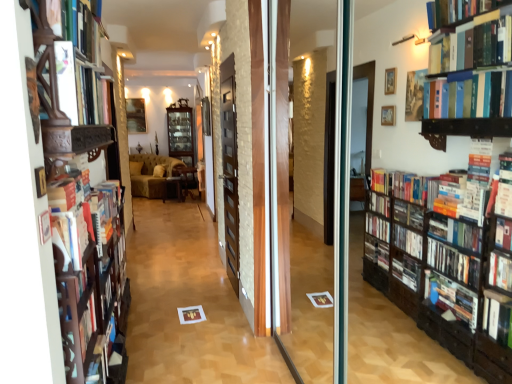
What do you see at coordinates (176, 186) in the screenshot? I see `wooden side table at center, the 2th furniture when ordered from left to right` at bounding box center [176, 186].

Measure the distance between point (136,154) and camera.

The depth of point (136,154) is 26.91 feet.

The width and height of the screenshot is (512, 384). I want to click on velvet brown sofa at center, the 3th furniture from the right, so click(x=152, y=175).

Measure the distance between matte white book at left, which is counted as the 2th book, starting from the top, and camera.

matte white book at left, which is counted as the 2th book, starting from the top, is 1.47 meters away from camera.

Describe the element at coordinates (81, 87) in the screenshot. This screenshot has width=512, height=384. I see `matte white book at left, which is counted as the 2th book, starting from the top` at that location.

The height and width of the screenshot is (384, 512). Identify the location of matte brown paper at center. (191, 314).

Consider the image. How many degrees apart are the facing directions of wooden table at center, the third furniture positioned from the left, and matte white book at upper left, which ranks as the 1th book in top-to-bottom order?

100 degrees separate the facing orientations of wooden table at center, the third furniture positioned from the left, and matte white book at upper left, which ranks as the 1th book in top-to-bottom order.

Who is more distant, wooden table at center, which appears as the 1th furniture when viewed from the right, or matte white book at upper left, which ranks as the 1th book in top-to-bottom order?

Positioned behind is wooden table at center, which appears as the 1th furniture when viewed from the right.

Considering the relative sizes of wooden table at center, which appears as the 1th furniture when viewed from the right, and matte white book at upper left, which ranks as the 2th book in bottom-to-top order, in the image provided, is wooden table at center, which appears as the 1th furniture when viewed from the right, taller than matte white book at upper left, which ranks as the 2th book in bottom-to-top order,?

Indeed, wooden table at center, which appears as the 1th furniture when viewed from the right, has a greater height compared to matte white book at upper left, which ranks as the 2th book in bottom-to-top order.

From a real-world perspective, between wooden table at center, the third furniture positioned from the left, and matte white book at upper left, which ranks as the 1th book in top-to-bottom order, who is vertically lower?

From a 3D spatial view, wooden table at center, the third furniture positioned from the left, is below.

Between wooden table at center, which appears as the 1th furniture when viewed from the right, and matte white book at left, which is counted as the 2th book, starting from the top, which one has smaller width?

With smaller width is matte white book at left, which is counted as the 2th book, starting from the top.

Could you tell me if wooden table at center, the third furniture positioned from the left, is turned towards matte white book at left, which is the first book from bottom to top?

Yes, wooden table at center, the third furniture positioned from the left, is aimed at matte white book at left, which is the first book from bottom to top.

Considering the positions of objects wooden table at center, which appears as the 1th furniture when viewed from the right, and matte white book at left, which is the first book from bottom to top, in the image provided, who is behind, wooden table at center, which appears as the 1th furniture when viewed from the right, or matte white book at left, which is the first book from bottom to top,?

wooden table at center, which appears as the 1th furniture when viewed from the right, is behind.

Is wooden table at center, which appears as the 1th furniture when viewed from the right, closer to the viewer compared to wooden side table at center, the 2th furniture when ordered from left to right?

That is True.

Is point (179, 173) more distant than point (163, 200)?

Yes, point (179, 173) is farther from viewer.

How different are the orientations of wooden table at center, which appears as the 1th furniture when viewed from the right, and wooden side table at center, the 2th furniture when ordered from left to right, in degrees?

2.85 degrees.

Would you consider wooden table at center, the third furniture positioned from the left, to be distant from wooden side table at center, the 2th furniture when ordered from left to right?

wooden table at center, the third furniture positioned from the left, is near wooden side table at center, the 2th furniture when ordered from left to right, not far away.

How many degrees apart are the facing directions of wooden side table at center, marked as the second furniture in a right-to-left arrangement, and velvet brown sofa at center, the 3th furniture from the right?

There is a 8.12-degree angle between the facing directions of wooden side table at center, marked as the second furniture in a right-to-left arrangement, and velvet brown sofa at center, the 3th furniture from the right.

Considering the sizes of objects wooden side table at center, marked as the second furniture in a right-to-left arrangement, and velvet brown sofa at center, the 3th furniture from the right, in the image provided, who is bigger, wooden side table at center, marked as the second furniture in a right-to-left arrangement, or velvet brown sofa at center, the 3th furniture from the right,?

velvet brown sofa at center, the 3th furniture from the right.

Which point is more forward, (x=179, y=193) or (x=150, y=158)?

The point (x=179, y=193) is closer.

Does wooden side table at center, marked as the second furniture in a right-to-left arrangement, contain velvet brown sofa at center, the 3th furniture from the right?

No, velvet brown sofa at center, the 3th furniture from the right, is not surrounded by wooden side table at center, marked as the second furniture in a right-to-left arrangement.

Is matte white book at left, which is counted as the 2th book, starting from the top, positioned far away from wooden side table at center, marked as the second furniture in a right-to-left arrangement?

matte white book at left, which is counted as the 2th book, starting from the top, is positioned a significant distance from wooden side table at center, marked as the second furniture in a right-to-left arrangement.

Is matte white book at left, which is the first book from bottom to top, located outside wooden side table at center, marked as the second furniture in a right-to-left arrangement?

Indeed, matte white book at left, which is the first book from bottom to top, is completely outside wooden side table at center, marked as the second furniture in a right-to-left arrangement.

From a real-world perspective, does matte white book at left, which is the first book from bottom to top, stand above wooden side table at center, the 2th furniture when ordered from left to right?

Yes, from a real-world perspective, matte white book at left, which is the first book from bottom to top, is above wooden side table at center, the 2th furniture when ordered from left to right.

From the image's perspective, is matte white book at left, which is counted as the 2th book, starting from the top, below wooden side table at center, the 2th furniture when ordered from left to right?

Incorrect, from the image's perspective, matte white book at left, which is counted as the 2th book, starting from the top, is higher than wooden side table at center, the 2th furniture when ordered from left to right.

Is matte white book at upper left, which ranks as the 2th book in bottom-to-top order, placed right next to wooden side table at center, marked as the second furniture in a right-to-left arrangement?

No, matte white book at upper left, which ranks as the 2th book in bottom-to-top order, is not touching wooden side table at center, marked as the second furniture in a right-to-left arrangement.

From a real-world perspective, relative to wooden side table at center, the 2th furniture when ordered from left to right, is matte white book at upper left, which ranks as the 2th book in bottom-to-top order, vertically above or below?

matte white book at upper left, which ranks as the 2th book in bottom-to-top order, is above wooden side table at center, the 2th furniture when ordered from left to right.

Is wooden table at center, which appears as the 1th furniture when viewed from the right, thinner than velvet brown sofa at center, arranged as the first furniture when viewed from the left?

Yes, wooden table at center, which appears as the 1th furniture when viewed from the right, is thinner than velvet brown sofa at center, arranged as the first furniture when viewed from the left.

Considering their positions, is wooden table at center, which appears as the 1th furniture when viewed from the right, located in front of or behind velvet brown sofa at center, the 3th furniture from the right?

In the image, wooden table at center, which appears as the 1th furniture when viewed from the right, appears in front of velvet brown sofa at center, the 3th furniture from the right.

Does wooden table at center, the third furniture positioned from the left, turn towards velvet brown sofa at center, the 3th furniture from the right?

No, wooden table at center, the third furniture positioned from the left, is not aimed at velvet brown sofa at center, the 3th furniture from the right.

Considering the points (182, 185) and (136, 157), which point is in front, point (182, 185) or point (136, 157)?

Point (182, 185)

From the image's perspective, which book is the 2nd one above the wooden table at center, which appears as the 1th furniture when viewed from the right? Please provide its 2D coordinates.

[(77, 26)]

Identify the location of the 2nd furniture directly beneath the matte white book at left, which is counted as the 2th book, starting from the top (from a real-world perspective). Image resolution: width=512 pixels, height=384 pixels. (186, 182).

Consider the image. Estimate the real-world distances between objects in this image. Which object is further from matte brown paper at center, dark brown wooden screen door at center or matte white book at left, which is the first book from bottom to top?

Among the two, matte white book at left, which is the first book from bottom to top, is located further to matte brown paper at center.

When comparing their distances from matte white book at left, which is counted as the 2th book, starting from the top, does wooden table at center, which appears as the 1th furniture when viewed from the right, or wooden bookshelf at left seem further?

wooden table at center, which appears as the 1th furniture when viewed from the right, is positioned further to the anchor matte white book at left, which is counted as the 2th book, starting from the top.

Estimate the real-world distances between objects in this image. Which object is closer to wooden bookshelf at left, dark brown wooden screen door at center or matte brown paper at center?

Among the two, matte brown paper at center is located nearer to wooden bookshelf at left.

From the image, which object appears to be nearer to matte brown paper at center, velvet brown sofa at center, arranged as the first furniture when viewed from the left, or wooden bookshelf at left?

wooden bookshelf at left.

Estimate the real-world distances between objects in this image. Which object is closer to dark brown wooden screen door at center, wooden bookshelf at left or matte white book at upper left, which ranks as the 2th book in bottom-to-top order?

Among the two, wooden bookshelf at left is located nearer to dark brown wooden screen door at center.

Considering their positions, is dark brown wooden screen door at center positioned further to matte white book at upper left, which ranks as the 2th book in bottom-to-top order, than wooden side table at center, marked as the second furniture in a right-to-left arrangement?

The object further to matte white book at upper left, which ranks as the 2th book in bottom-to-top order, is wooden side table at center, marked as the second furniture in a right-to-left arrangement.

Which object lies nearer to the anchor point dark brown wooden screen door at center, velvet brown sofa at center, arranged as the first furniture when viewed from the left, or wooden table at center, which appears as the 1th furniture when viewed from the right?

Among the two, velvet brown sofa at center, arranged as the first furniture when viewed from the left, is located nearer to dark brown wooden screen door at center.

Based on their spatial positions, is wooden bookshelf at left or matte white book at left, which is counted as the 2th book, starting from the top, further from velvet brown sofa at center, arranged as the first furniture when viewed from the left?

Based on the image, matte white book at left, which is counted as the 2th book, starting from the top, appears to be further to velvet brown sofa at center, arranged as the first furniture when viewed from the left.

Where is `furniture between velvet brown sofa at center, the 3th furniture from the right, and wooden table at center, which appears as the 1th furniture when viewed from the right`? Image resolution: width=512 pixels, height=384 pixels. furniture between velvet brown sofa at center, the 3th furniture from the right, and wooden table at center, which appears as the 1th furniture when viewed from the right is located at coordinates (176, 186).

I want to click on book between matte white book at upper left, which ranks as the 1th book in top-to-bottom order, and wooden bookshelf at left in the up-down direction, so click(81, 87).

Identify the location of paperback book between matte white book at left, which is counted as the 2th book, starting from the top, and wooden side table at center, marked as the second furniture in a right-to-left arrangement, along the z-axis. Image resolution: width=512 pixels, height=384 pixels. coord(191,314).

Where is `screen door between matte brown paper at center and wooden table at center, which appears as the 1th furniture when viewed from the right, from front to back`? This screenshot has height=384, width=512. screen door between matte brown paper at center and wooden table at center, which appears as the 1th furniture when viewed from the right, from front to back is located at coordinates (230, 169).